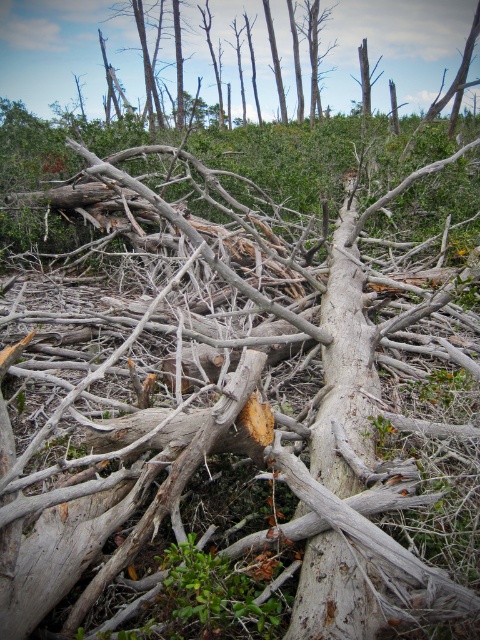
What do you see at coordinates (345, 368) in the screenshot? Image resolution: width=480 pixels, height=640 pixels. I see `gray rough bark tree trunk at center` at bounding box center [345, 368].

Is point (368, 388) positioned in front of point (153, 4)?

Yes, it is.

Where is `gray rough bark tree trunk at center`? The width and height of the screenshot is (480, 640). gray rough bark tree trunk at center is located at coordinates (345, 368).